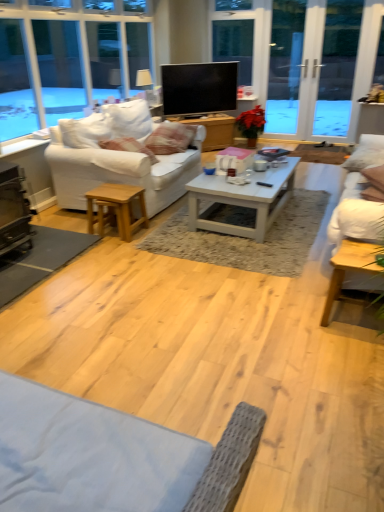
Where is `free spot in front of light brown wooden coffee table at center, acting as the 1th coffee table starting from the bottom`? The image size is (384, 512). free spot in front of light brown wooden coffee table at center, acting as the 1th coffee table starting from the bottom is located at coordinates (351, 355).